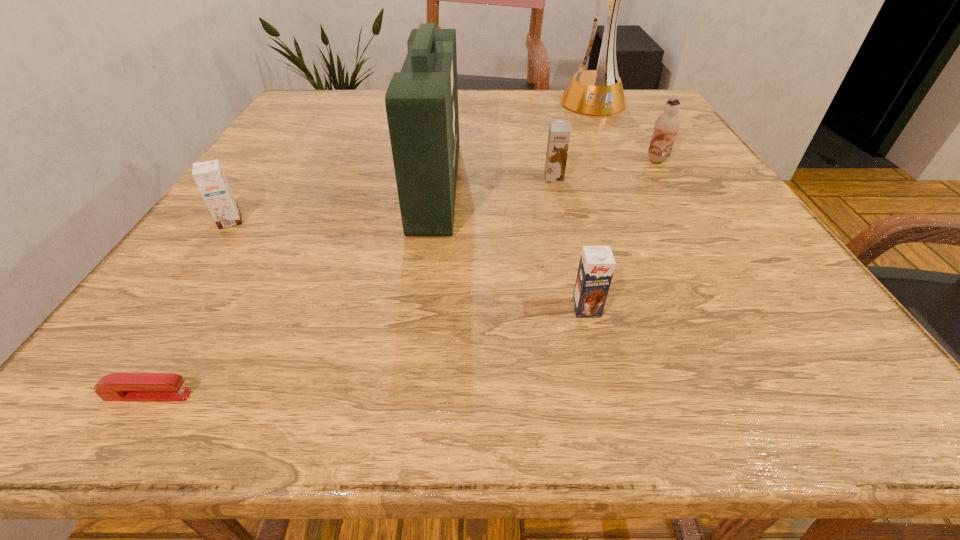
The width and height of the screenshot is (960, 540). In order to click on vacant space located on the front-facing side of the farthest object in this screenshot , I will do `click(607, 136)`.

At what (x,y) coordinates should I click in order to perform the action: click on vacant region located 0.060m on the front-facing side of the first-aid kit. Please return your answer as a coordinate pair (x, y). Looking at the image, I should click on (487, 184).

The width and height of the screenshot is (960, 540). Find the location of `vacant space situated 0.110m on the left of the farthest chocolate milk`. vacant space situated 0.110m on the left of the farthest chocolate milk is located at coordinates (595, 160).

The width and height of the screenshot is (960, 540). I want to click on free space located 0.270m on the back of the second farthest chocolate milk, so click(540, 119).

This screenshot has width=960, height=540. I want to click on vacant space located 0.240m on the right of the third farthest chocolate milk, so click(x=378, y=221).

This screenshot has width=960, height=540. I want to click on vacant space situated on the front label of the sixth farthest object, so click(607, 392).

This screenshot has height=540, width=960. Identify the location of free region located 0.240m on the front-facing side of the stapler. (389, 395).

You are a GUI agent. You are given a task and a screenshot of the screen. Output one action in this format:
    pyautogui.click(x=<x>, y=<y>)
    Task: Click on the object that is at the far edge
    
    Given the screenshot: What is the action you would take?
    pyautogui.click(x=599, y=92)

You are a GUI agent. You are given a task and a screenshot of the screen. Output one action in this format:
    pyautogui.click(x=<x>, y=<y>)
    Task: Click on the object present at the near edge
    
    Given the screenshot: What is the action you would take?
    pyautogui.click(x=117, y=386)

What are the coordinates of `chocolate milk at the left edge` in the screenshot? It's located at (209, 176).